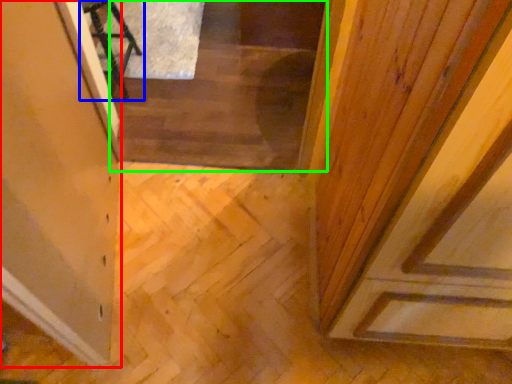
Question: Which object is the farthest from glass door (highlighted by a red box)? Choose among these: furniture (highlighted by a blue box) or stairwell (highlighted by a green box).

Choices:
 (A) furniture
 (B) stairwell

Answer: (A)